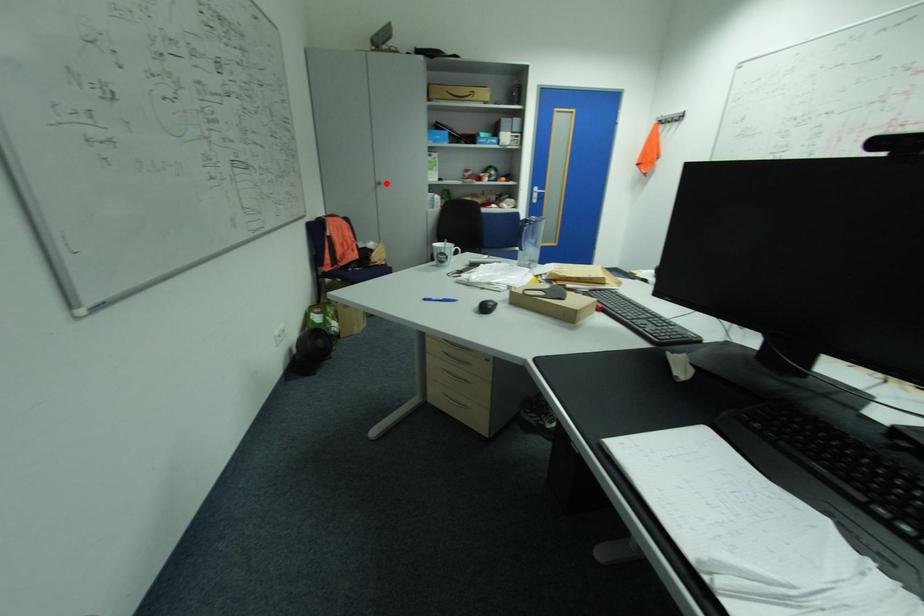
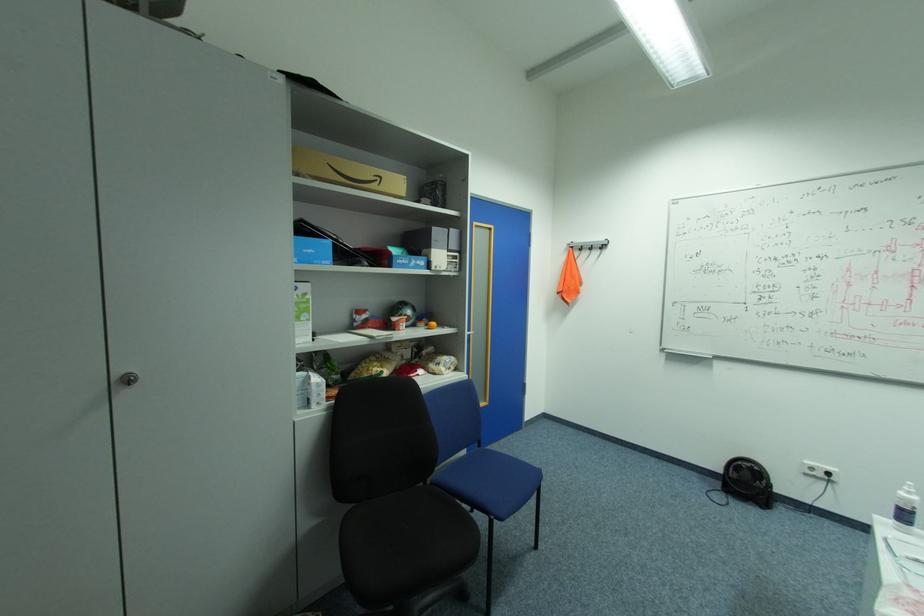
In the second image, find the point that corresponds to the highlighted location in the first image.

(137, 379)